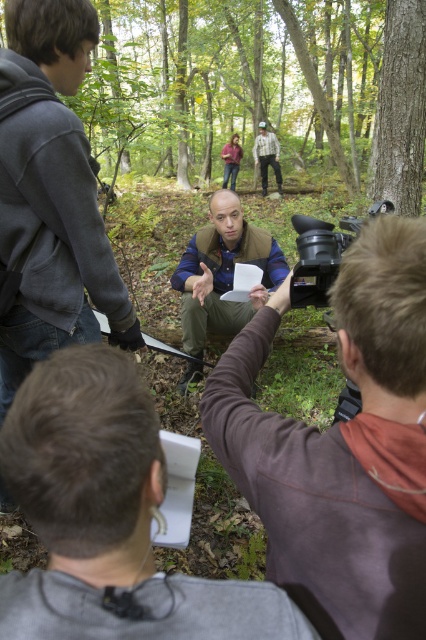
Question: Can you confirm if gray matte paper at lower center is positioned above plaid flannel shirt at center?

Choices:
 (A) yes
 (B) no

Answer: (B)

Question: Which point is closer to the camera taking this photo?

Choices:
 (A) (261, 150)
 (B) (241, 205)
 (C) (408, 129)
 (D) (48, 566)

Answer: (D)

Question: Does green leafy forest at upper center have a smaller size compared to plaid flannel shirt at center?

Choices:
 (A) no
 (B) yes

Answer: (A)

Question: Estimate the real-world distances between objects in this image. Which object is closer to the smooth bark tree at upper right?

Choices:
 (A) blue fabric shirt at center
 (B) green leafy forest at upper center

Answer: (A)

Question: Can you confirm if green leafy forest at upper center is thinner than gray matte paper at lower center?

Choices:
 (A) yes
 (B) no

Answer: (B)

Question: Which point is closer to the camera?

Choices:
 (A) (265, 166)
 (B) (374, 429)

Answer: (B)